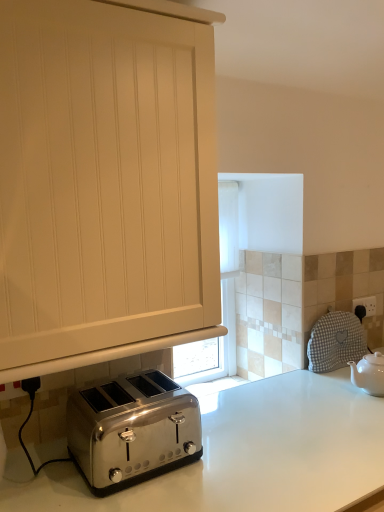
Where is `free space that is to the left of white ceramic teapot at right`? The image size is (384, 512). free space that is to the left of white ceramic teapot at right is located at coordinates (326, 393).